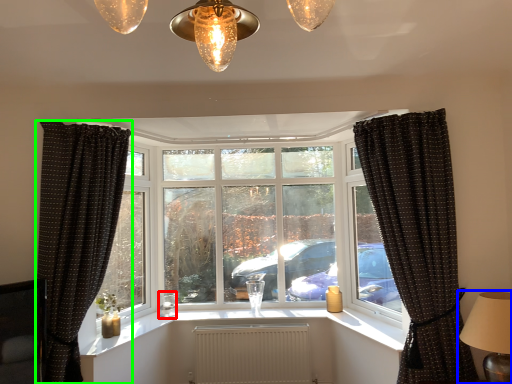
Question: Based on their relative distances, which object is farther from candle holder (highlighted by a red box)? Choose from table lamp (highlighted by a blue box) and curtain (highlighted by a green box).

Choices:
 (A) table lamp
 (B) curtain

Answer: (A)